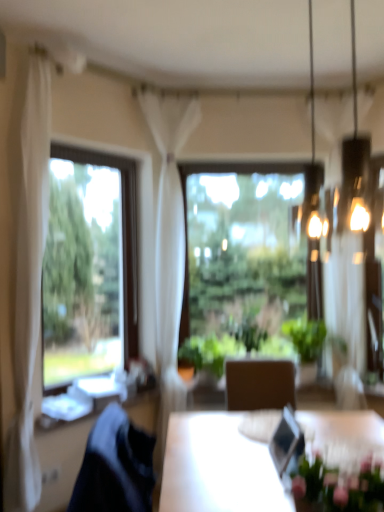
Question: Is white sheer curtain at left, placed as the first curtain when sorted from front to back, wider or thinner than clear glass window at left, which is the first window from left to right?

Choices:
 (A) wide
 (B) thin

Answer: (A)

Question: Would you say white sheer curtain at left, the 2th curtain when ordered from back to front, is inside or outside clear glass window at left, the 2th window positioned from the back?

Choices:
 (A) outside
 (B) inside

Answer: (A)

Question: Estimate the real-world distances between objects in this image. Which object is closer to the pink matte floral arrangement at lower right?

Choices:
 (A) white sheer curtain at left, acting as the 1th curtain starting from the left
 (B) white sheer curtain at center, the second curtain in the left-to-right sequence
 (C) transparent glass window at center, which appears as the 2th window when viewed from the left
 (D) metallic glass chandelier at upper right
 (E) clear glass window at left, the 1th window viewed from the front

Answer: (A)

Question: Estimate the real-world distances between objects in this image. Which object is farther from the transparent glass window at center, marked as the first window in a right-to-left arrangement?

Choices:
 (A) white sheer curtain at left, placed as the first curtain when sorted from front to back
 (B) metallic glass chandelier at upper right
 (C) pink matte floral arrangement at lower right
 (D) white sheer curtain at center, the second curtain in the left-to-right sequence
 (E) clear glass window at left, the 1th window viewed from the front

Answer: (C)